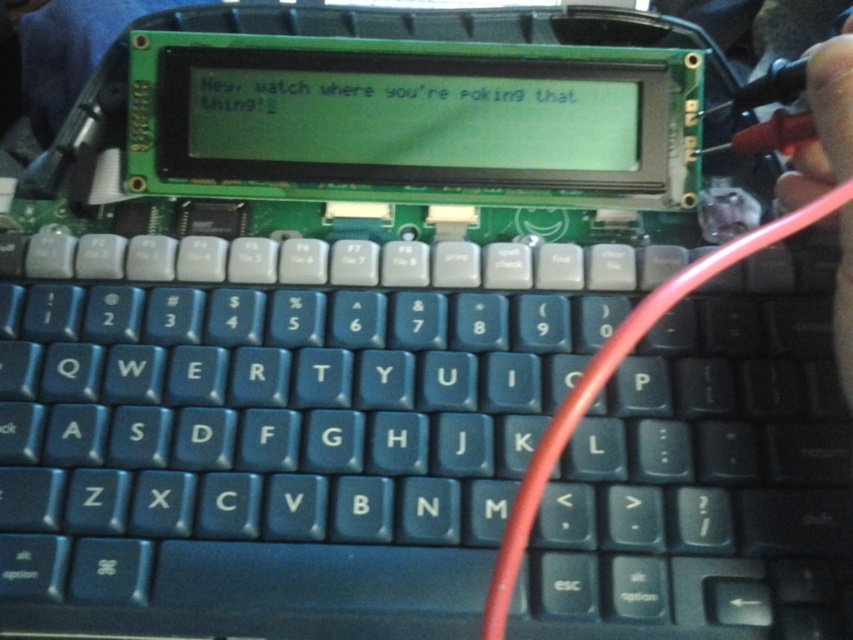
Is black plastic keyboard at center behind red rubber cable at right?

Yes, black plastic keyboard at center is further from the viewer.

Can you confirm if black plastic keyboard at center is positioned above red rubber cable at right?

No.

Image resolution: width=853 pixels, height=640 pixels. What do you see at coordinates (280, 424) in the screenshot? I see `black plastic keyboard at center` at bounding box center [280, 424].

Where is `black plastic keyboard at center`? This screenshot has height=640, width=853. black plastic keyboard at center is located at coordinates (280, 424).